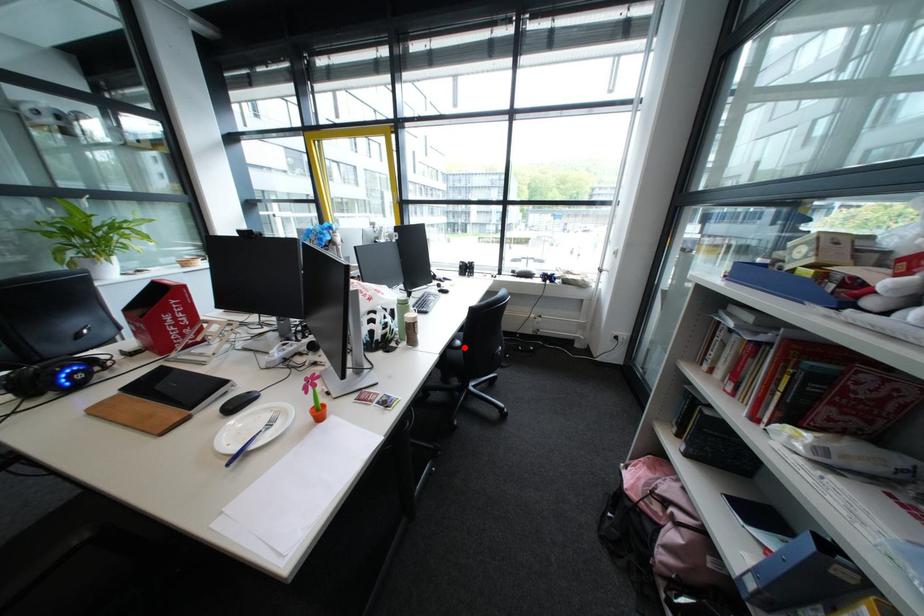
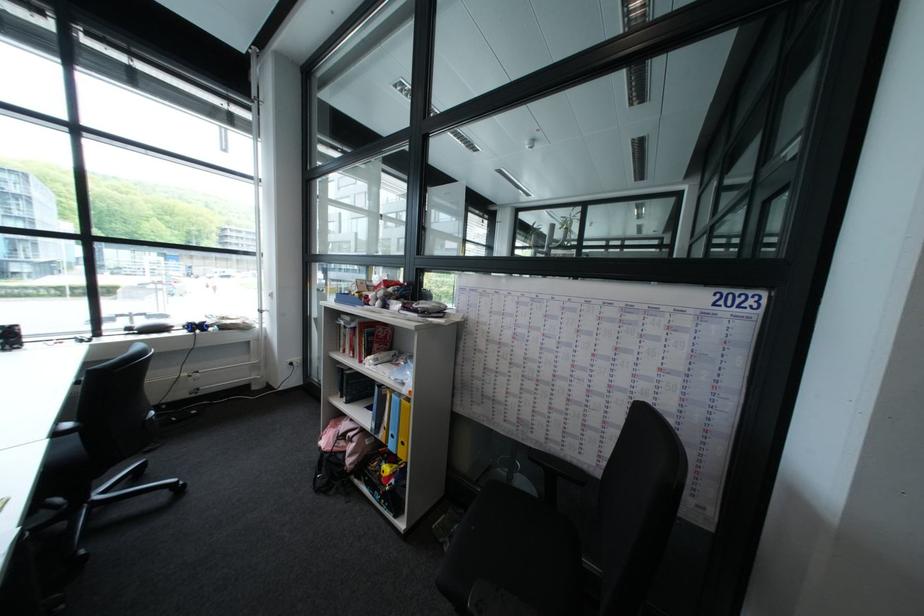
Question: A red point is marked in image1. In image2, is the corresponding 3D point closer to the camera or farther? Reply with the corresponding letter.

Choices:
 (A) The corresponding 3D point is closer.
 (B) The corresponding 3D point is farther.

Answer: (B)